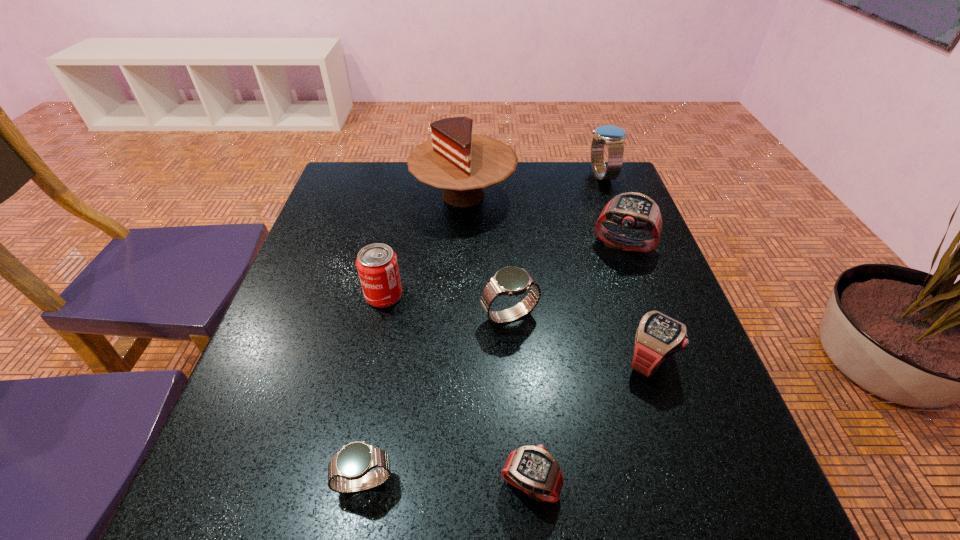
Find the location of `free space between the second biggest red watch and the red cake`. free space between the second biggest red watch and the red cake is located at coordinates (557, 278).

Locate an element on the screen. The height and width of the screenshot is (540, 960). free space between the farthest watch and the can is located at coordinates (492, 235).

Locate an element on the screen. empty space that is in between the leftmost red watch and the red can is located at coordinates (457, 390).

Select which object appears as the sixth closest to the smallest blue watch. Please provide its 2D coordinates. Your answer should be formatted as a tuple, i.e. [(x, y)], where the tuple contains the x and y coordinates of a point satisfying the conditions above.

[(632, 210)]

Locate which object ranks seventh in proximity to the can. Please provide its 2D coordinates. Your answer should be formatted as a tuple, i.e. [(x, y)], where the tuple contains the x and y coordinates of a point satisfying the conditions above.

[(613, 137)]

Identify the location of watch that is the fourth closest to the red can. The image size is (960, 540). (658, 337).

The height and width of the screenshot is (540, 960). Find the location of `the second closest watch to the biggest red watch`. the second closest watch to the biggest red watch is located at coordinates point(511,281).

Point out which blue watch is positioned as the third nearest to the red can. Please provide its 2D coordinates. Your answer should be formatted as a tuple, i.e. [(x, y)], where the tuple contains the x and y coordinates of a point satisfying the conditions above.

[(613, 137)]

Identify the location of blue watch that is the third closest to the cake. The height and width of the screenshot is (540, 960). (348, 471).

The width and height of the screenshot is (960, 540). In order to click on red watch that is the third closest one to the can in this screenshot , I will do `click(632, 210)`.